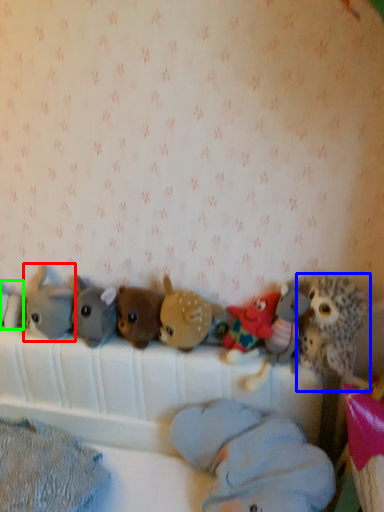
Question: Which is farther away from toy (highlighted by a red box)? toy (highlighted by a blue box) or toy (highlighted by a green box)?

Choices:
 (A) toy
 (B) toy

Answer: (A)